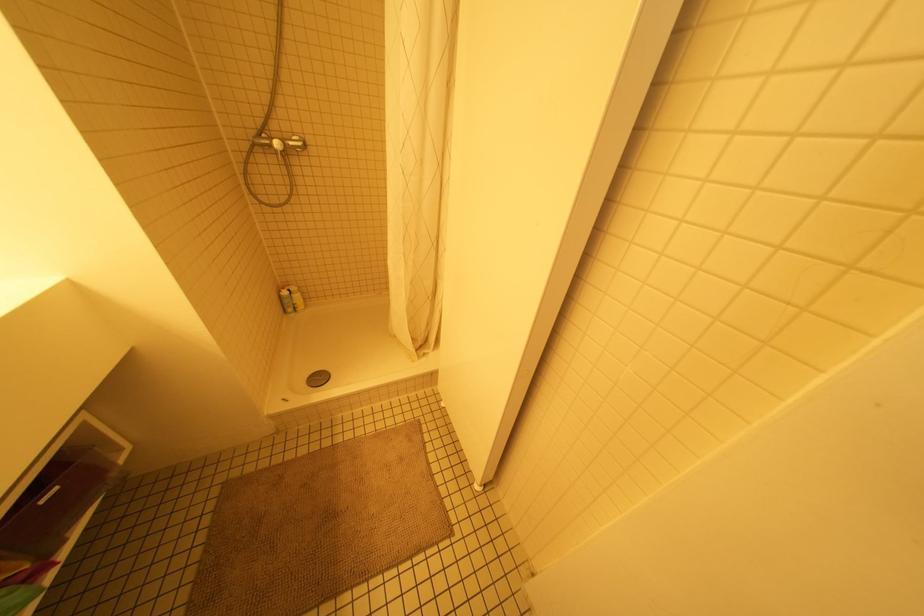
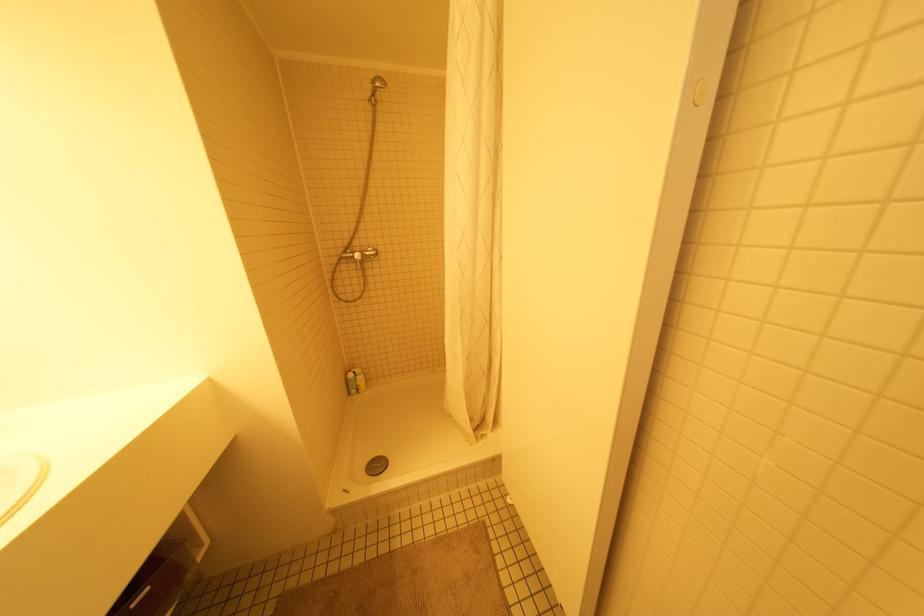
What movement of the cameraman would produce the second image?

The cameraman moved toward left, backward.